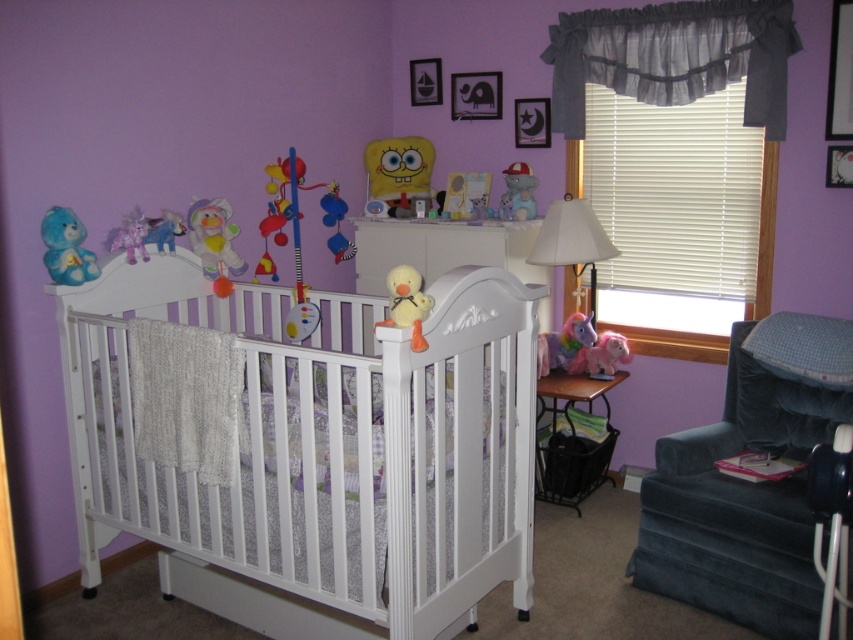
Question: Can you confirm if yellow plush duck at center is positioned above blue plush elephant at upper left?

Choices:
 (A) yes
 (B) no

Answer: (B)

Question: Is matte plastic elephant at center above metallic rectangular frame at upper center?

Choices:
 (A) yes
 (B) no

Answer: (B)

Question: Does wooden changing table at lower right appear on the right side of white fabric lampshade at center?

Choices:
 (A) yes
 (B) no

Answer: (B)

Question: Which point is closer to the camera?

Choices:
 (A) white wooden crib at center
 (B) black paper picture frame at upper center
 (C) wooden picture frame at upper center

Answer: (A)

Question: Which of the following is the closest to the observer?

Choices:
 (A) wooden picture frame at upper right
 (B) gray fabric valance at upper right

Answer: (A)

Question: Which point is closer to the camera?

Choices:
 (A) white wooden crib at center
 (B) black paper picture frame at upper center

Answer: (A)